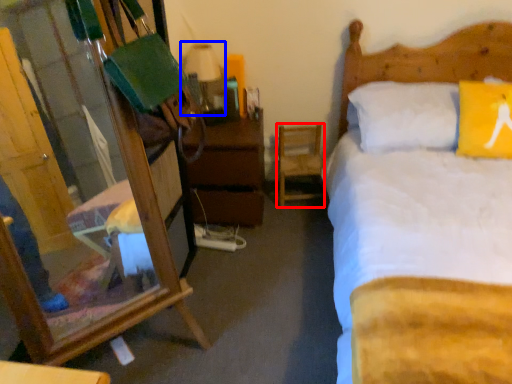
Question: Which object appears farthest to the camera in this image, chair (highlighted by a red box) or table lamp (highlighted by a blue box)?

Choices:
 (A) chair
 (B) table lamp

Answer: (A)